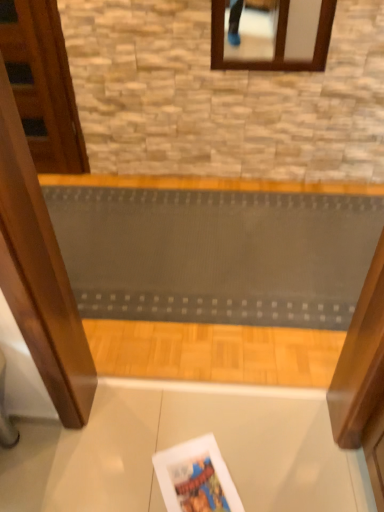
At what (x,y) coordinates should I click in order to perform the action: click on free location to the right of matte paper magazine at lower center. Please return your answer as a coordinate pair (x, y). Looking at the image, I should click on (272, 468).